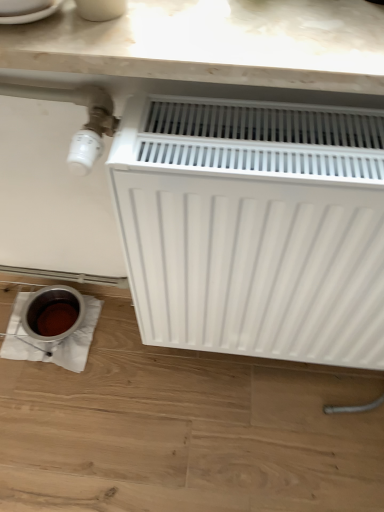
Question: Would you say white marble countertop at upper center is outside white matte radiator at center?

Choices:
 (A) yes
 (B) no

Answer: (A)

Question: Is white marble countertop at upper center wider than white matte radiator at center?

Choices:
 (A) yes
 (B) no

Answer: (A)

Question: Is white marble countertop at upper center taller than white matte radiator at center?

Choices:
 (A) yes
 (B) no

Answer: (B)

Question: From a real-world perspective, is white marble countertop at upper center on white matte radiator at center?

Choices:
 (A) yes
 (B) no

Answer: (A)

Question: From the image's perspective, is white marble countertop at upper center located above white matte radiator at center?

Choices:
 (A) yes
 (B) no

Answer: (A)

Question: Are white marble countertop at upper center and white matte radiator at center beside each other?

Choices:
 (A) yes
 (B) no

Answer: (B)

Question: From the image's perspective, is white matte radiator at center on white marble countertop at upper center?

Choices:
 (A) no
 (B) yes

Answer: (A)

Question: Can you confirm if white matte radiator at center is positioned to the right of white marble countertop at upper center?

Choices:
 (A) no
 (B) yes

Answer: (B)

Question: Does white matte radiator at center have a greater width compared to white marble countertop at upper center?

Choices:
 (A) yes
 (B) no

Answer: (B)

Question: Can you confirm if white matte radiator at center is taller than white marble countertop at upper center?

Choices:
 (A) yes
 (B) no

Answer: (A)

Question: From a real-world perspective, is white matte radiator at center physically below white marble countertop at upper center?

Choices:
 (A) no
 (B) yes

Answer: (B)

Question: Considering the relative sizes of white matte radiator at center and white marble countertop at upper center in the image provided, is white matte radiator at center bigger than white marble countertop at upper center?

Choices:
 (A) no
 (B) yes

Answer: (B)

Question: In terms of size, does white matte radiator at center appear bigger or smaller than white marble countertop at upper center?

Choices:
 (A) small
 (B) big

Answer: (B)